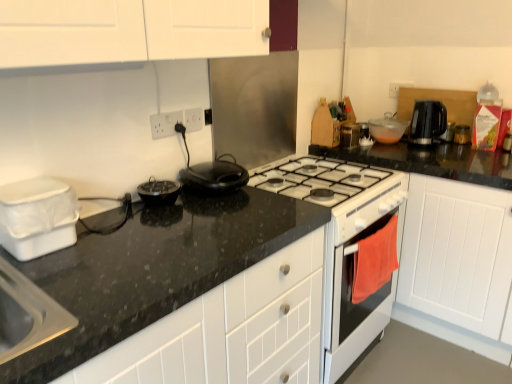
Identify the location of vacant point to the right of white plastic container at left, placed as the seventh kitchen appliance when sorted from right to left. (115, 248).